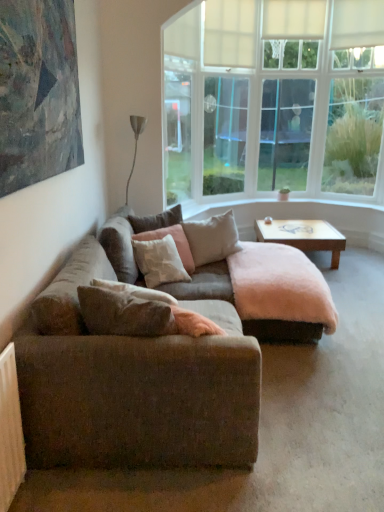
Image resolution: width=384 pixels, height=512 pixels. Find the location of `wooden at center`. wooden at center is located at coordinates (303, 236).

Where is `soft pink fabric pillow at center, marked as the first pillow in a back-to-front arrangement`? The width and height of the screenshot is (384, 512). soft pink fabric pillow at center, marked as the first pillow in a back-to-front arrangement is located at coordinates (156, 220).

You are a GUI agent. You are given a task and a screenshot of the screen. Output one action in this format:
    pyautogui.click(x=<x>, y=<y>)
    Task: Click on the textured canvas painting at upper left
    
    Given the screenshot: What is the action you would take?
    pyautogui.click(x=38, y=92)

In order to face beige fabric pillow at center, which is the second pillow from back to front, should I rotate leftwards or rightwards?

You should rotate right by 2.801 degrees.

Identify the location of beige fabric pillow at center, which is the second pillow from back to front. (212, 238).

Identify the location of wooden at center. Image resolution: width=384 pixels, height=512 pixels. 303,236.

From the image's perspective, is soft pink fabric pillow at center, which is the 4th pillow from front to back, located above or below textured brown couch at center?

Based on their image positions, soft pink fabric pillow at center, which is the 4th pillow from front to back, is located above textured brown couch at center.

From a real-world perspective, which object rests below the other?

textured brown couch at center, from a real-world perspective.

Is soft pink fabric pillow at center, which is the 4th pillow from front to back, far away from textured brown couch at center?

Yes, soft pink fabric pillow at center, which is the 4th pillow from front to back, and textured brown couch at center are located far from each other.

Which is more to the right, beige fabric pillow at center, which is the second pillow from back to front, or textured canvas painting at upper left?

From the viewer's perspective, beige fabric pillow at center, which is the second pillow from back to front, appears more on the right side.

From the image's perspective, which is below, beige fabric pillow at center, which appears as the 3th pillow when viewed from the front, or textured canvas painting at upper left?

beige fabric pillow at center, which appears as the 3th pillow when viewed from the front, from the image's perspective.

From a real-world perspective, which is physically below, beige fabric pillow at center, which appears as the 3th pillow when viewed from the front, or textured canvas painting at upper left?

In real-world perspective, beige fabric pillow at center, which appears as the 3th pillow when viewed from the front, is lower.

Which is in front, textured brown couch at center or white soft pillow at center, which is the 2th pillow in front-to-back order?

textured brown couch at center is more forward.

From a real-world perspective, is textured brown couch at center physically above white soft pillow at center, the third pillow viewed from the back?

No, from a real-world perspective, textured brown couch at center is not over white soft pillow at center, the third pillow viewed from the back

There is a textured brown couch at center. Where is `the 1st pillow above it (from the image's perspective)`? the 1st pillow above it (from the image's perspective) is located at coordinates (159, 261).

In terms of size, does textured brown couch at center appear bigger or smaller than white soft pillow at center, which is the 2th pillow in front-to-back order?

In the image, textured brown couch at center appears to be larger than white soft pillow at center, which is the 2th pillow in front-to-back order.

Is textured brown couch at center at the back of metallic silver floor lamp at upper left?

That's not correct — metallic silver floor lamp at upper left is not looking away from textured brown couch at center.

Would you say metallic silver floor lamp at upper left is inside or outside textured brown couch at center?

metallic silver floor lamp at upper left is outside textured brown couch at center.

Considering the points (133, 160) and (253, 245), which point is behind, point (133, 160) or point (253, 245)?

Positioned behind is point (133, 160).

The width and height of the screenshot is (384, 512). Find the location of `lamp that is on the left side of cotton/pink pillow at center, which is the 1th pillow from front to back`. lamp that is on the left side of cotton/pink pillow at center, which is the 1th pillow from front to back is located at coordinates (135, 142).

Can you tell me how much cotton/pink pillow at center, which is the 4th pillow from back to front, and metallic silver floor lamp at upper left differ in facing direction?

There is a 22.5-degree angle between the facing directions of cotton/pink pillow at center, which is the 4th pillow from back to front, and metallic silver floor lamp at upper left.

Between cotton/pink pillow at center, which is the 4th pillow from back to front, and metallic silver floor lamp at upper left, which one has larger size?

metallic silver floor lamp at upper left is bigger.

Which of these two, cotton/pink pillow at center, which is the 4th pillow from back to front, or metallic silver floor lamp at upper left, stands taller?

With more height is metallic silver floor lamp at upper left.

Looking at this image, does metallic silver floor lamp at upper left lie in front of wooden at center?

Yes, metallic silver floor lamp at upper left is in front of wooden at center.

Is metallic silver floor lamp at upper left far from wooden at center?

Yes.

Does textured brown couch at center come behind cotton/pink pillow at center, which is the 1th pillow from front to back?

Yes, the depth of textured brown couch at center is greater than that of cotton/pink pillow at center, which is the 1th pillow from front to back.

Considering the sizes of objects textured brown couch at center and cotton/pink pillow at center, which is the 1th pillow from front to back, in the image provided, who is smaller, textured brown couch at center or cotton/pink pillow at center, which is the 1th pillow from front to back,?

Smaller between the two is cotton/pink pillow at center, which is the 1th pillow from front to back.

Is textured brown couch at center at the left side of cotton/pink pillow at center, which is the 1th pillow from front to back?

No, textured brown couch at center is not to the left of cotton/pink pillow at center, which is the 1th pillow from front to back.

This screenshot has width=384, height=512. I want to click on couch above the cotton/pink pillow at center, which is the 4th pillow from back to front (from the image's perspective), so click(267, 292).

Where is `the 4th pillow positioned above the textured brown couch at center (from the image's perspective)`? The width and height of the screenshot is (384, 512). the 4th pillow positioned above the textured brown couch at center (from the image's perspective) is located at coordinates (156, 220).

Find the location of a particular element. picture frame in front of the beige fabric pillow at center, which appears as the 3th pillow when viewed from the front is located at coordinates click(x=38, y=92).

Which object lies nearer to the anchor point soft pink fabric pillow at center, marked as the first pillow in a back-to-front arrangement, textured brown couch at center or textured canvas painting at upper left?

textured brown couch at center lies closer to soft pink fabric pillow at center, marked as the first pillow in a back-to-front arrangement, than the other object.

Based on their spatial positions, is soft pink fabric pillow at center, which is the 4th pillow from front to back, or textured canvas painting at upper left closer to textured brown couch at center?

soft pink fabric pillow at center, which is the 4th pillow from front to back.

From the image, which object appears to be nearer to cotton/pink pillow at center, which is the 4th pillow from back to front, soft pink fabric pillow at center, which is the 4th pillow from front to back, or textured brown couch at center?

The object closer to cotton/pink pillow at center, which is the 4th pillow from back to front, is textured brown couch at center.

From the image, which object appears to be farther from metallic silver floor lamp at upper left, textured brown couch at center or textured brown couch at center?

The object further to metallic silver floor lamp at upper left is textured brown couch at center.

Estimate the real-world distances between objects in this image. Which object is further from metallic silver floor lamp at upper left, textured brown couch at center or soft pink fabric pillow at center, marked as the first pillow in a back-to-front arrangement?

Based on the image, textured brown couch at center appears to be further to metallic silver floor lamp at upper left.

Looking at the image, which one is located closer to soft pink fabric pillow at center, marked as the first pillow in a back-to-front arrangement, beige fabric pillow at center, which appears as the 3th pillow when viewed from the front, or white soft pillow at center, the third pillow viewed from the back?

The object closer to soft pink fabric pillow at center, marked as the first pillow in a back-to-front arrangement, is beige fabric pillow at center, which appears as the 3th pillow when viewed from the front.

Based on their spatial positions, is soft pink fabric pillow at center, which is the 4th pillow from front to back, or cotton/pink pillow at center, which is the 4th pillow from back to front, further from textured brown couch at center?

cotton/pink pillow at center, which is the 4th pillow from back to front, is positioned further to the anchor textured brown couch at center.

Which object lies further to the anchor point metallic silver floor lamp at upper left, wooden at center or white soft pillow at center, which is the 2th pillow in front-to-back order?

Based on the image, wooden at center appears to be further to metallic silver floor lamp at upper left.

Locate an element on the screen. The image size is (384, 512). studio couch between textured canvas painting at upper left and textured brown couch at center from front to back is located at coordinates (160, 362).

Identify the location of studio couch between textured canvas painting at upper left and white soft pillow at center, which is the 2th pillow in front-to-back order, in the front-back direction. (160, 362).

Locate an element on the screen. Image resolution: width=384 pixels, height=512 pixels. couch located between cotton/pink pillow at center, which is the 4th pillow from back to front, and soft pink fabric pillow at center, which is the 4th pillow from front to back, in the depth direction is located at coordinates (267, 292).

This screenshot has width=384, height=512. Identify the location of couch located between textured canvas painting at upper left and beige fabric pillow at center, which is the second pillow from back to front, in the depth direction. pos(267,292).